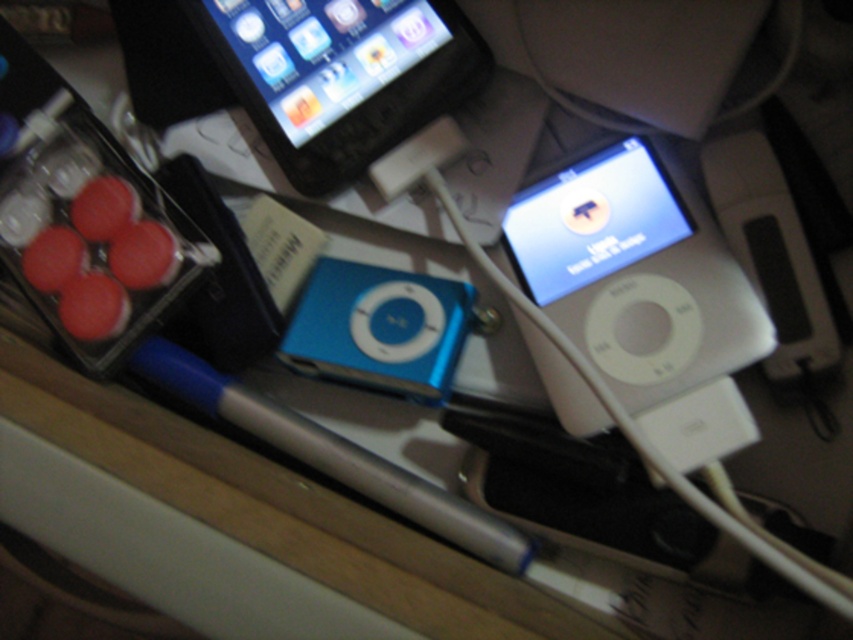
Question: Is white glossy ipod at upper right thinner than matte black phone at upper center?

Choices:
 (A) yes
 (B) no

Answer: (A)

Question: Does white glossy ipod at upper right lie behind blue plastic ipod at center?

Choices:
 (A) no
 (B) yes

Answer: (A)

Question: Which of these objects is positioned closest to the blue plastic ipod at center?

Choices:
 (A) matte black phone at upper center
 (B) white glossy ipod at upper right

Answer: (B)

Question: Considering the real-world distances, which object is closest to the blue plastic ipod at center?

Choices:
 (A) white glossy ipod at upper right
 (B) matte black phone at upper center
 (C) white plastic ipod at upper right

Answer: (A)

Question: Estimate the real-world distances between objects in this image. Which object is farther from the matte black phone at upper center?

Choices:
 (A) white plastic ipod at upper right
 (B) white glossy ipod at upper right

Answer: (A)

Question: Can you confirm if white glossy ipod at upper right is positioned above blue plastic ipod at center?

Choices:
 (A) yes
 (B) no

Answer: (A)